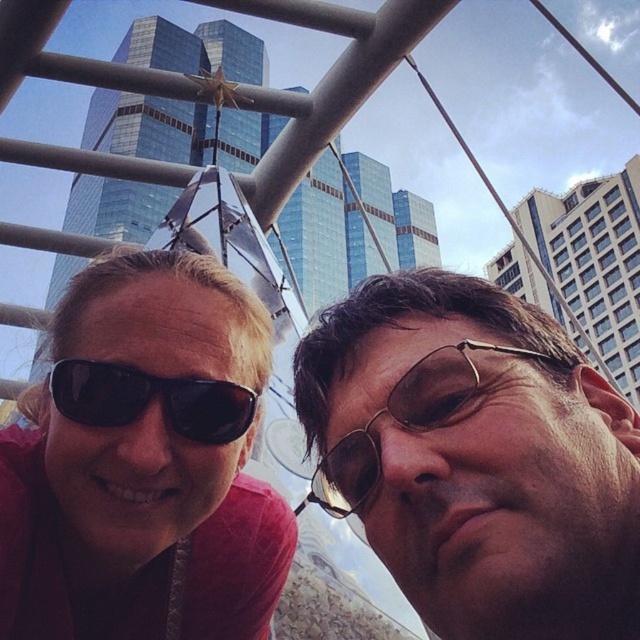
Question: Is metallic gold sunglasses at center above black matte sunglasses at left?

Choices:
 (A) yes
 (B) no

Answer: (B)

Question: Which of the following is the closest to the observer?

Choices:
 (A) matte black sunglasses at center
 (B) black matte sunglasses at left
 (C) metallic gold sunglasses at center

Answer: (A)

Question: Which of the following is the farthest from the observer?

Choices:
 (A) metallic gold sunglasses at center
 (B) metallic sunglasses at center

Answer: (A)

Question: Does matte black sunglasses at center have a smaller size compared to metallic gold sunglasses at center?

Choices:
 (A) yes
 (B) no

Answer: (B)

Question: Which point is closer to the camera?

Choices:
 (A) metallic gold sunglasses at center
 (B) metallic sunglasses at center
 (C) matte black sunglasses at center
 (D) black matte sunglasses at left

Answer: (B)

Question: Is metallic gold sunglasses at center positioned before black matte sunglasses at left?

Choices:
 (A) no
 (B) yes

Answer: (A)